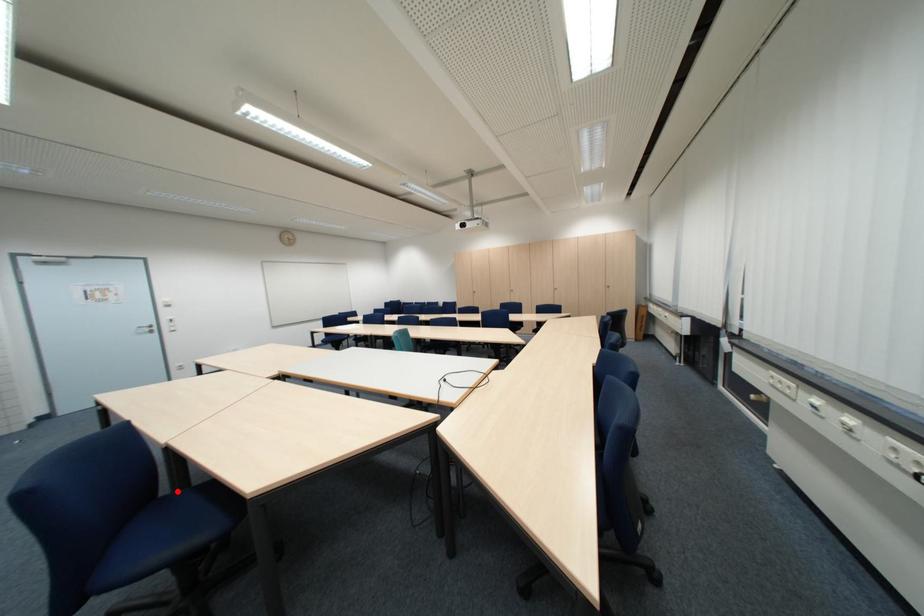
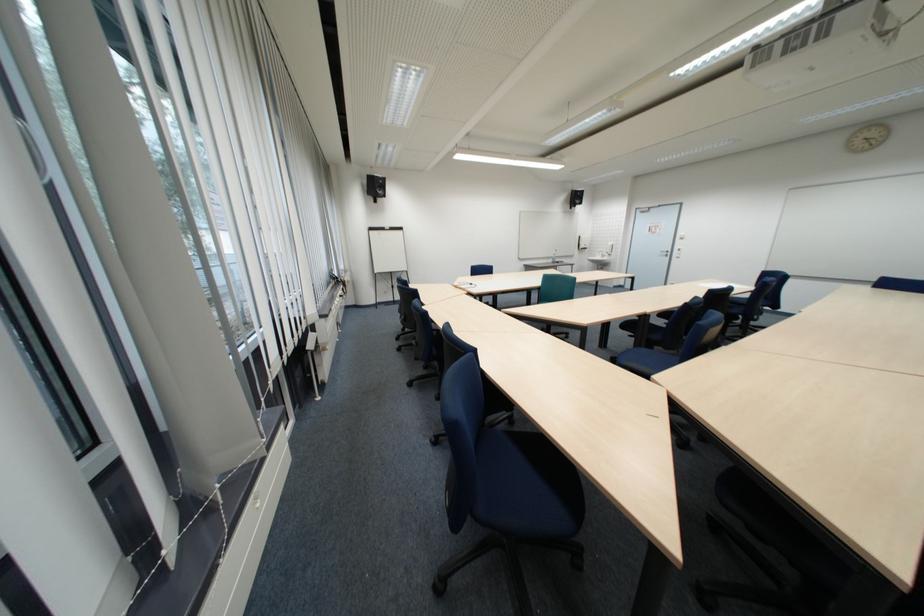
Question: I am providing you with two images of the same scene from different viewpoints. A red point is marked on the first image. At the location where the point appears in image 1, is it still visible in image 2?

Choices:
 (A) Yes
 (B) No

Answer: (B)